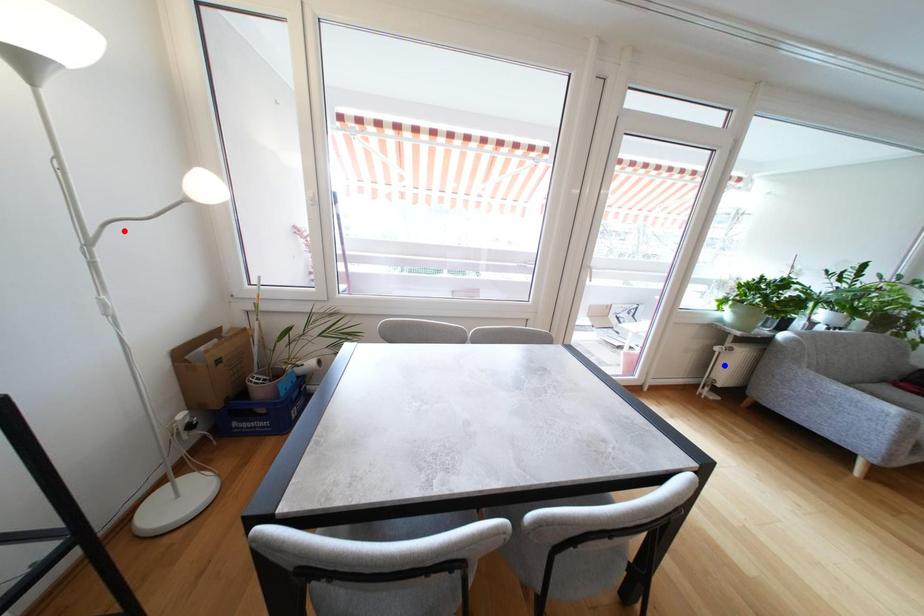
Question: Two points are marked on the image. Which point is closer to the camera?

Choices:
 (A) Blue point is closer.
 (B) Red point is closer.

Answer: (B)